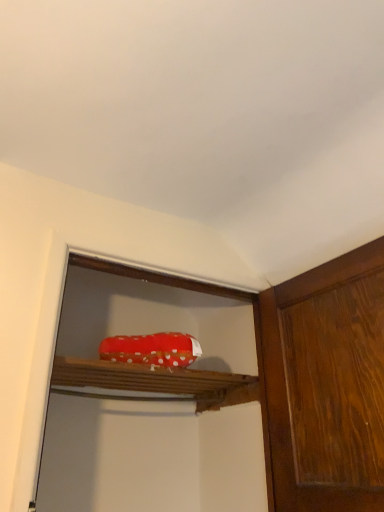
Question: Is the depth of wooden cabinet at center less than that of red polka dot fabric at center?

Choices:
 (A) no
 (B) yes

Answer: (B)

Question: Does wooden cabinet at center come behind red polka dot fabric at center?

Choices:
 (A) yes
 (B) no

Answer: (B)

Question: Is wooden cabinet at center not within red polka dot fabric at center?

Choices:
 (A) yes
 (B) no

Answer: (A)

Question: From the image's perspective, does wooden cabinet at center appear lower than red polka dot fabric at center?

Choices:
 (A) no
 (B) yes

Answer: (B)

Question: Considering the relative sizes of wooden cabinet at center and red polka dot fabric at center in the image provided, is wooden cabinet at center wider than red polka dot fabric at center?

Choices:
 (A) no
 (B) yes

Answer: (B)

Question: Is wooden cabinet at center positioned with its back to red polka dot fabric at center?

Choices:
 (A) no
 (B) yes

Answer: (A)

Question: Is red polka dot fabric at center touching wooden cabinet at center?

Choices:
 (A) no
 (B) yes

Answer: (A)

Question: From a real-world perspective, is red polka dot fabric at center under wooden cabinet at center?

Choices:
 (A) no
 (B) yes

Answer: (A)

Question: Is red polka dot fabric at center behind wooden cabinet at center?

Choices:
 (A) yes
 (B) no

Answer: (A)

Question: Are red polka dot fabric at center and wooden cabinet at center located far from each other?

Choices:
 (A) no
 (B) yes

Answer: (A)

Question: Would you say wooden cabinet at center is part of red polka dot fabric at center's contents?

Choices:
 (A) no
 (B) yes

Answer: (A)

Question: Can you confirm if red polka dot fabric at center is thinner than wooden cabinet at center?

Choices:
 (A) yes
 (B) no

Answer: (A)

Question: From a real-world perspective, is red polka dot fabric at center positioned above or below wooden cabinet at center?

Choices:
 (A) above
 (B) below

Answer: (A)